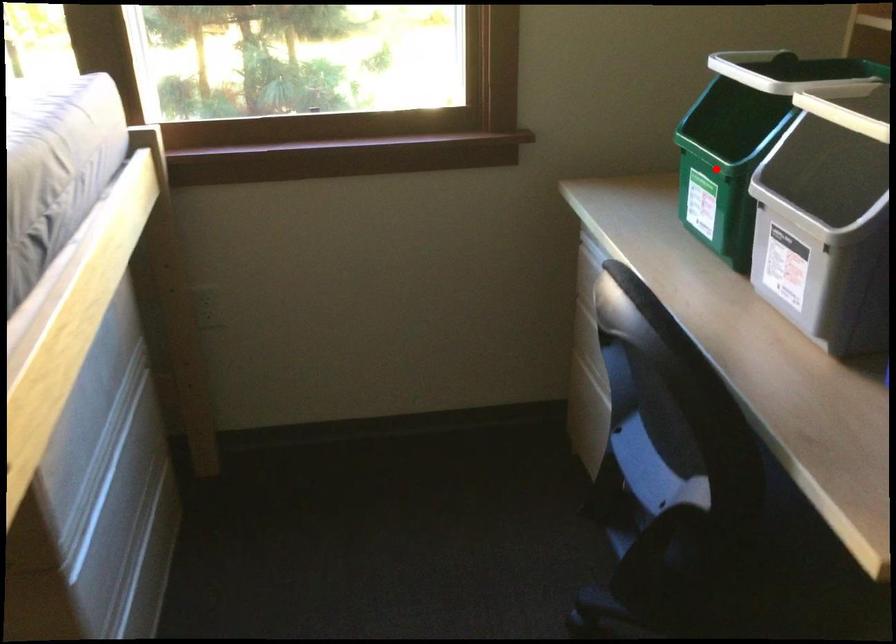
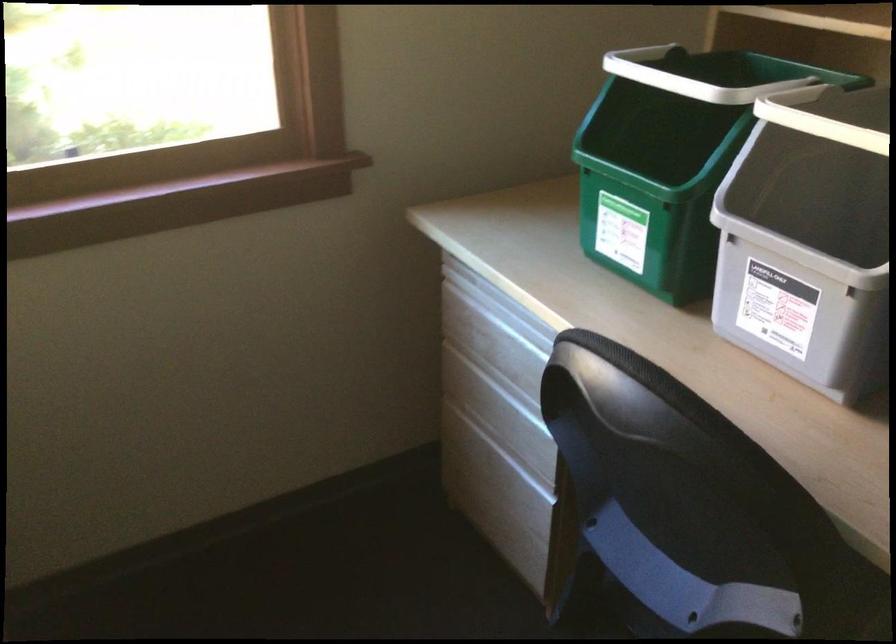
The point at the highlighted location is marked in the first image. Where is the corresponding point in the second image?

(652, 194)